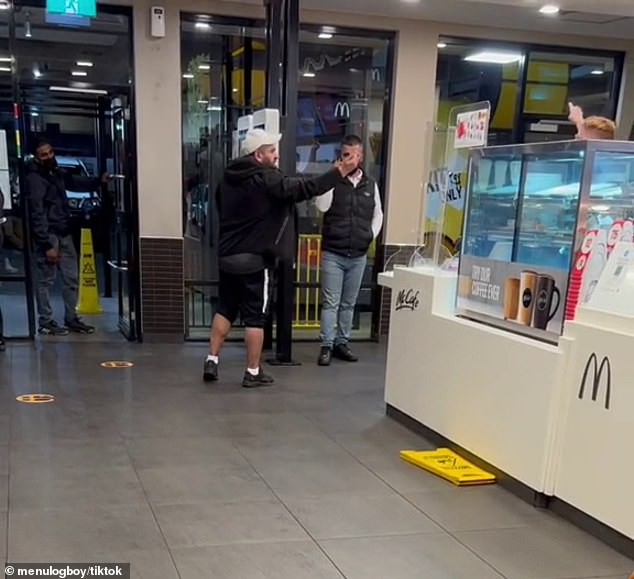
Where is `stuffed animal`? The image size is (634, 579). stuffed animal is located at coordinates (589, 127).